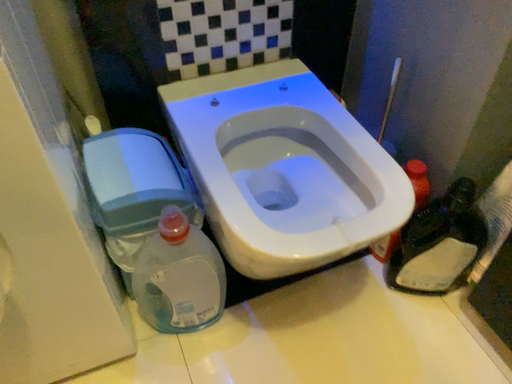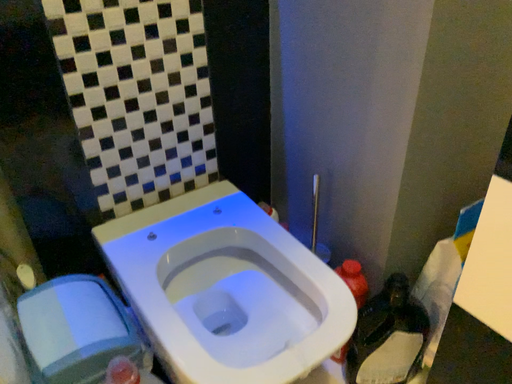
Question: How did the camera likely rotate when shooting the video?

Choices:
 (A) rotated upward
 (B) rotated downward

Answer: (A)